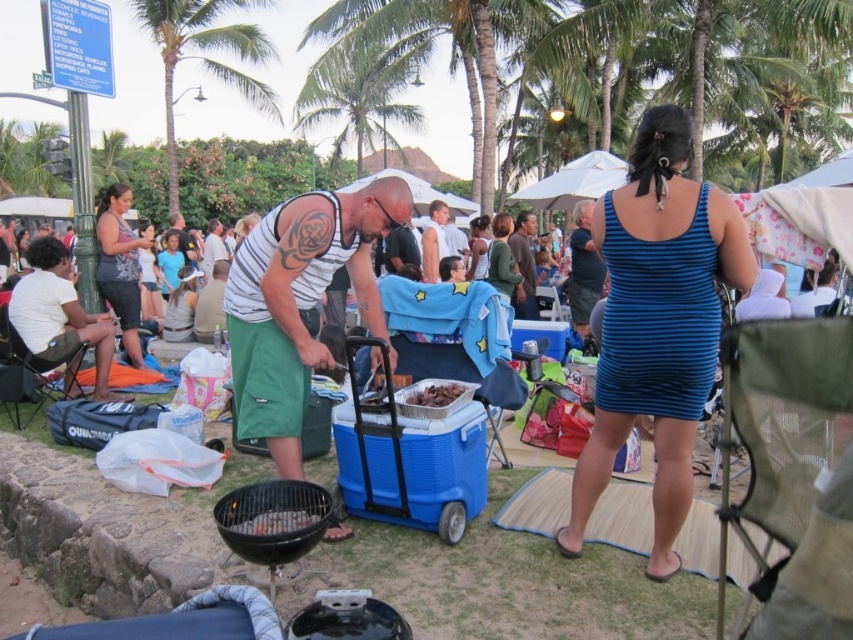
Which is in front, point (357, 52) or point (415, 396)?

Point (415, 396) is in front.

Is green leafy palm tree at upper center closer to the viewer compared to brown matte food at center?

No, green leafy palm tree at upper center is further to the viewer.

Which is behind, point (403, 120) or point (463, 387)?

Point (403, 120)

Where is `green leafy palm tree at upper center`? The width and height of the screenshot is (853, 640). green leafy palm tree at upper center is located at coordinates (355, 99).

Which of these two, green cotton shorts at center or green fabric shorts at center, stands shorter?

With less height is green cotton shorts at center.

Which is more to the right, green cotton shorts at center or green fabric shorts at center?

From the viewer's perspective, green cotton shorts at center appears more on the right side.

You are a GUI agent. You are given a task and a screenshot of the screen. Output one action in this format:
    pyautogui.click(x=<x>, y=<y>)
    Task: Click on the green cotton shorts at center
    
    Given the screenshot: What is the action you would take?
    pyautogui.click(x=299, y=301)

You are a GUI agent. You are given a task and a screenshot of the screen. Output one action in this format:
    pyautogui.click(x=<x>, y=<y>)
    Task: Click on the green cotton shorts at center
    This screenshot has height=640, width=853.
    Given the screenshot: What is the action you would take?
    299,301

Describe the element at coordinates (355, 99) in the screenshot. I see `green leafy palm tree at upper center` at that location.

Identify the location of green leafy palm tree at upper center. (355, 99).

Is point (337, 148) less distant than point (248, 532)?

No.

Identify the location of green leafy palm tree at upper center. This screenshot has height=640, width=853. (355, 99).